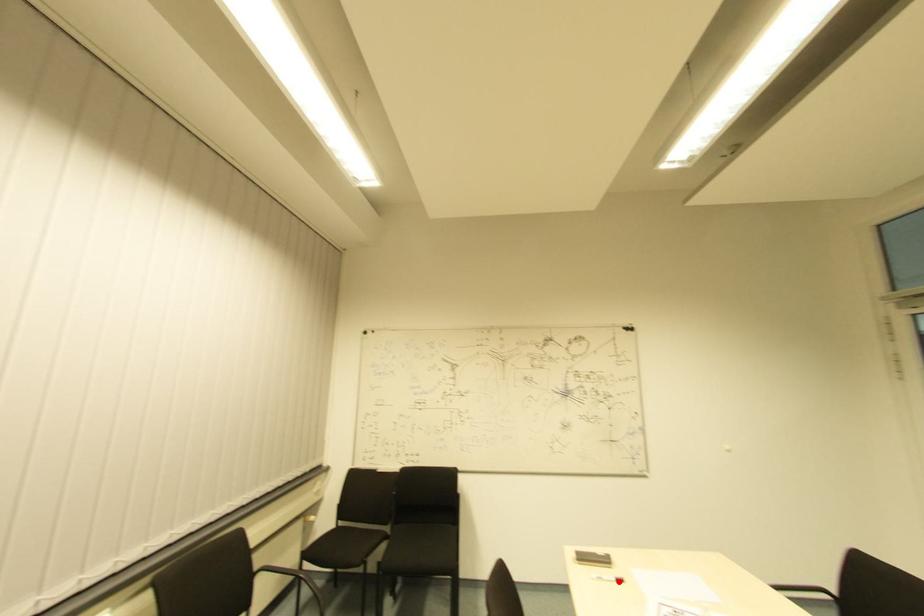
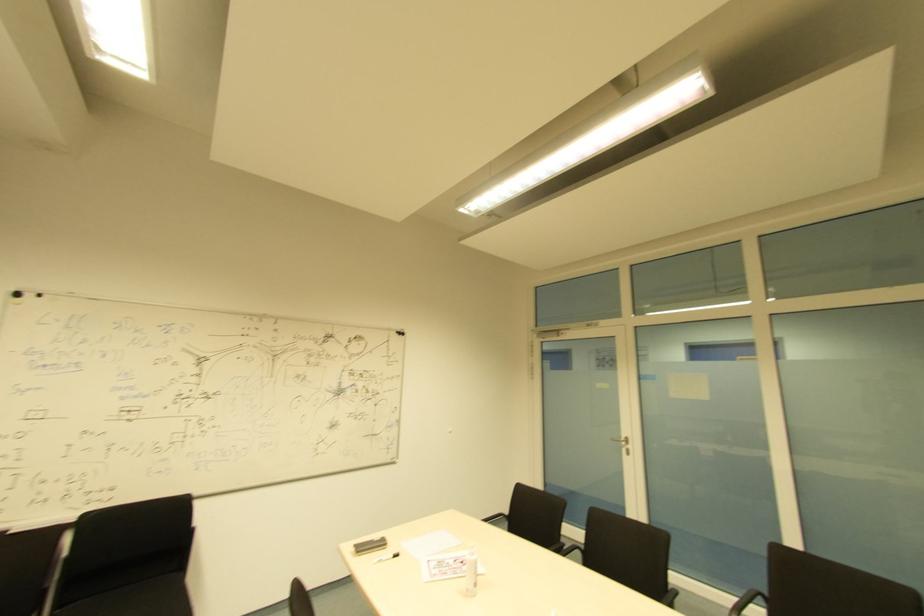
Find the pixel in the second image that matches the highlighted location in the first image.

(394, 554)